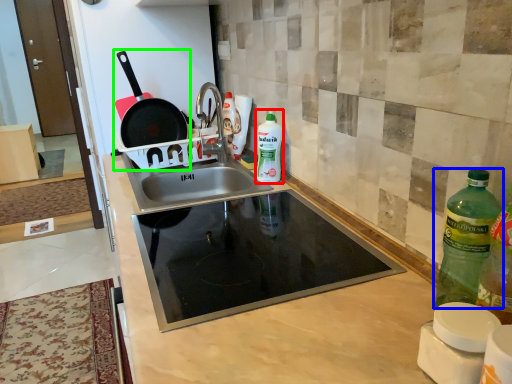
Question: Which object is the closest to the bottle (highlighted by a red box)? Choose among these: bottle (highlighted by a blue box) or frying pan (highlighted by a green box).

Choices:
 (A) bottle
 (B) frying pan

Answer: (B)